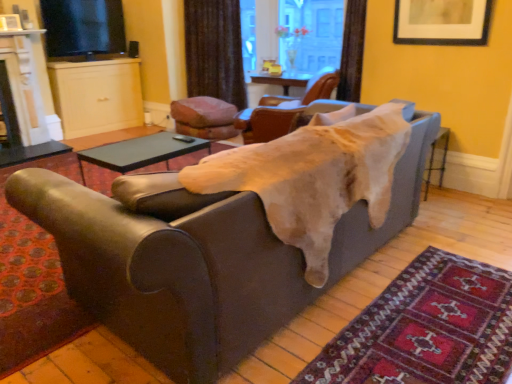
Question: Is brown leather chair at upper center, the 3th chair from the left, not close to matte black picture frame at upper right?

Choices:
 (A) yes
 (B) no

Answer: (A)

Question: Considering the relative sizes of brown leather chair at upper center, the 3th chair from the left, and matte black picture frame at upper right in the image provided, is brown leather chair at upper center, the 3th chair from the left, thinner than matte black picture frame at upper right?

Choices:
 (A) yes
 (B) no

Answer: (B)

Question: Does brown leather chair at upper center, which is the 1th chair from right to left, turn towards matte black picture frame at upper right?

Choices:
 (A) yes
 (B) no

Answer: (B)

Question: Does brown leather chair at upper center, the 3th chair from the left, have a lesser height compared to matte black picture frame at upper right?

Choices:
 (A) no
 (B) yes

Answer: (A)

Question: From the image's perspective, is brown leather chair at upper center, which is the 1th chair from right to left, below matte black picture frame at upper right?

Choices:
 (A) yes
 (B) no

Answer: (A)

Question: Is point (65, 14) positioned closer to the camera than point (424, 21)?

Choices:
 (A) farther
 (B) closer

Answer: (A)

Question: From the image's perspective, is black glossy tv at upper left positioned above or below matte black picture frame at upper right?

Choices:
 (A) above
 (B) below

Answer: (A)

Question: In terms of height, does black glossy tv at upper left look taller or shorter compared to matte black picture frame at upper right?

Choices:
 (A) short
 (B) tall

Answer: (B)

Question: Is black glossy tv at upper left wider or thinner than matte black picture frame at upper right?

Choices:
 (A) wide
 (B) thin

Answer: (A)

Question: Considering the positions of matte white fireplace at left and carpet at lower right in the image, is matte white fireplace at left bigger or smaller than carpet at lower right?

Choices:
 (A) small
 (B) big

Answer: (B)

Question: Visually, is matte white fireplace at left positioned to the left or to the right of carpet at lower right?

Choices:
 (A) left
 (B) right

Answer: (A)

Question: In terms of height, does matte white fireplace at left look taller or shorter compared to carpet at lower right?

Choices:
 (A) tall
 (B) short

Answer: (A)

Question: Is matte white fireplace at left wider or thinner than carpet at lower right?

Choices:
 (A) wide
 (B) thin

Answer: (B)

Question: From a real-world perspective, is brown fabric curtain at upper center above or below velvet-like brown cushion at center, the 3th chair in the right-to-left sequence?

Choices:
 (A) below
 (B) above

Answer: (B)

Question: Relative to velvet-like brown cushion at center, the 3th chair in the right-to-left sequence, is brown fabric curtain at upper center in front or behind?

Choices:
 (A) behind
 (B) front

Answer: (A)